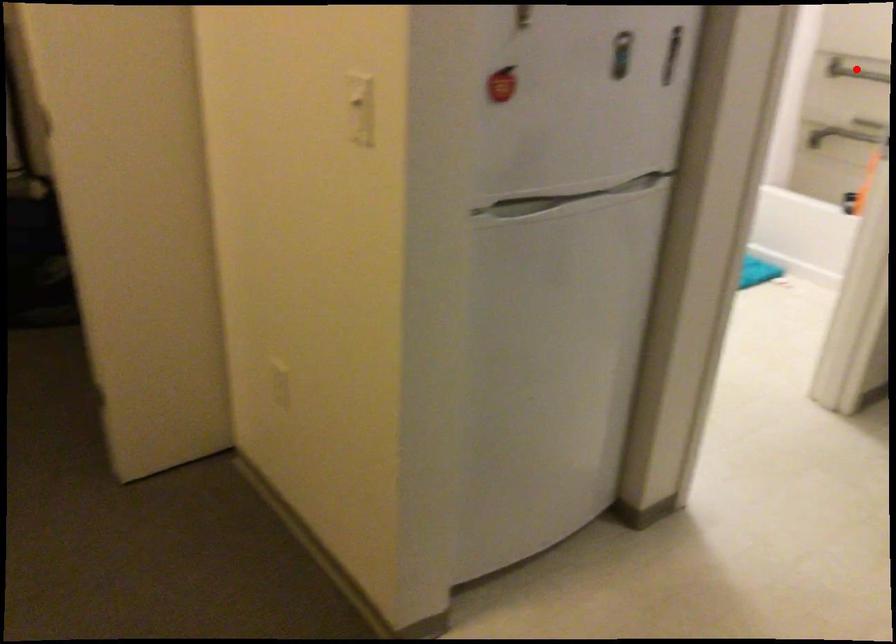
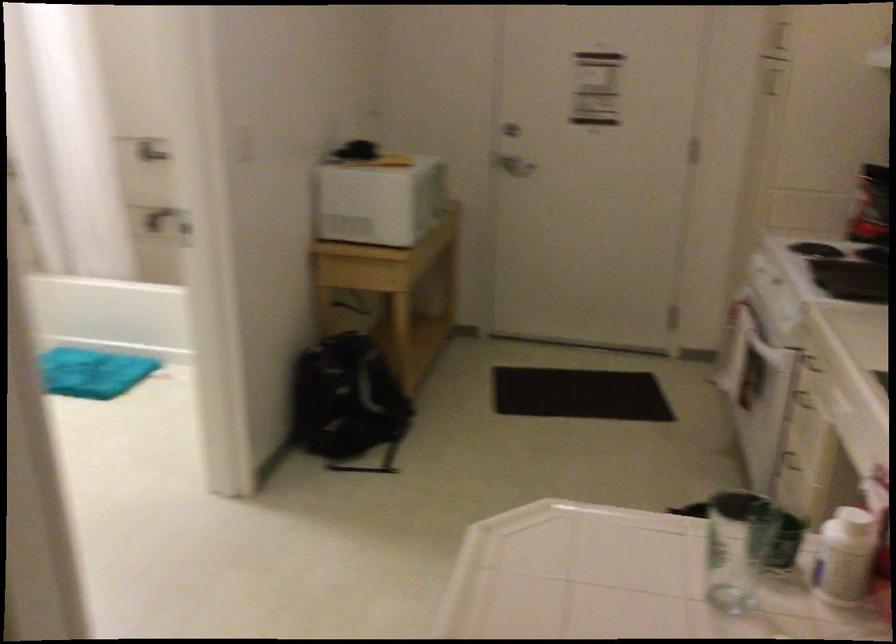
Question: I am providing you with two images of the same scene from different viewpoints. A red point is marked on the first image. Is the red point's position out of view in image 2?

Choices:
 (A) Yes
 (B) No

Answer: (A)